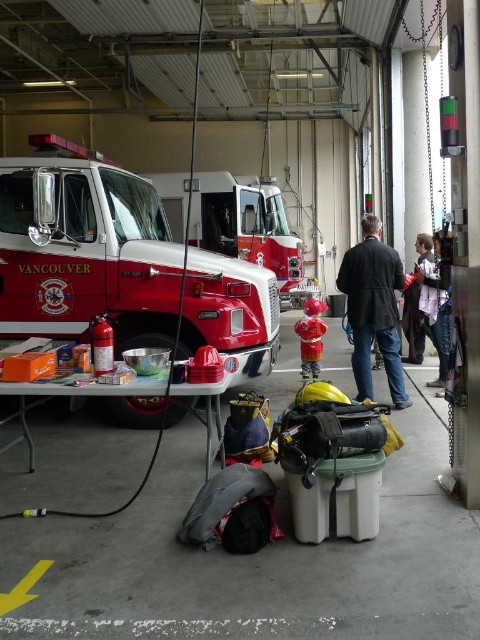
You are a firefighter preparing to enter the fire truck. You notice a white cotton shirt at right and a red matte fire extinguisher at left. Which item is taller?

The white cotton shirt at right is much taller than the red matte fire extinguisher at left.

You are a firefighter preparing to enter the fire truck. You see two jackets, the dark brown leather jacket at center and the light brown leather jacket at right. Which jacket is positioned lower in the scene?

The dark brown leather jacket at center is located below the light brown leather jacket at right, so it is positioned lower in the scene.